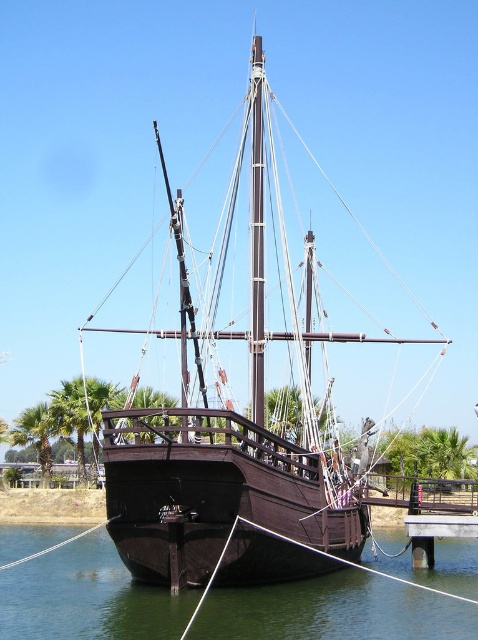
Is brown wooden sailboat at center to the right of green water at lower center from the viewer's perspective?

Yes, brown wooden sailboat at center is to the right of green water at lower center.

Is point (302, 513) positioned before point (377, 580)?

Yes.

Does point (258, 330) lie behind point (348, 582)?

Yes, point (258, 330) is farther from viewer.

Identify the location of brown wooden sailboat at center. Image resolution: width=478 pixels, height=640 pixels. (237, 419).